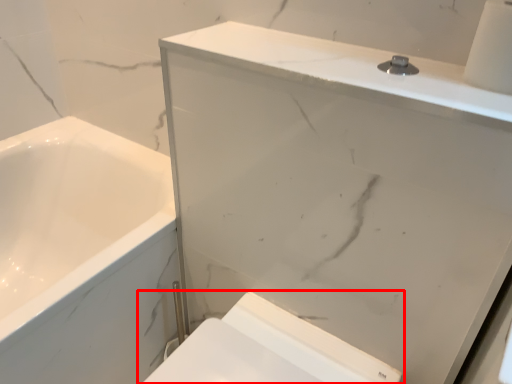
Question: Where is toilet (annotated by the red box) located in relation to medicine cabinet in the image?

Choices:
 (A) left
 (B) right

Answer: (A)